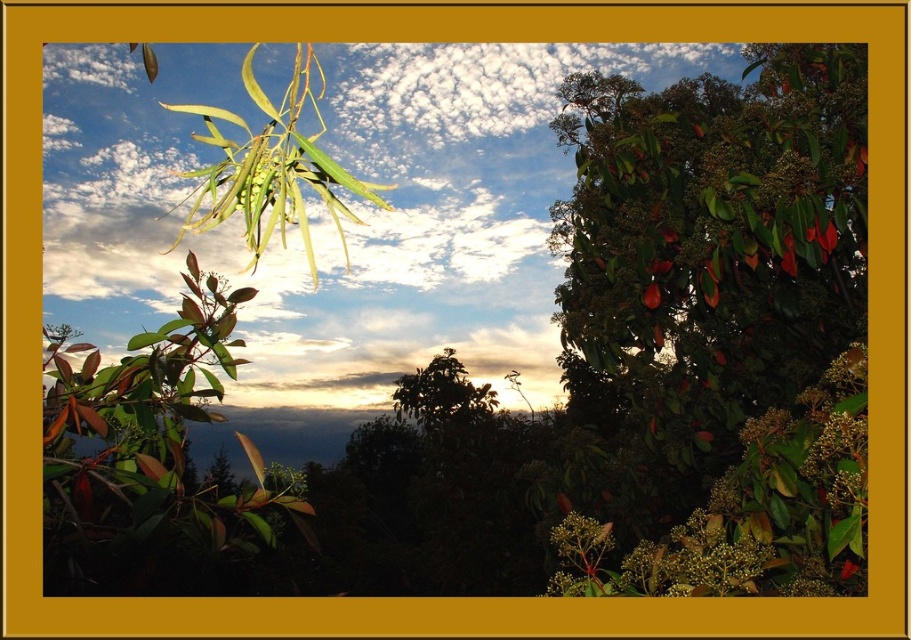
What do you see at coordinates (730, 292) in the screenshot? The height and width of the screenshot is (640, 911). I see `green glossy leaves at upper center` at bounding box center [730, 292].

I want to click on green glossy leaves at upper center, so click(730, 292).

Which is in front, point (118, 120) or point (206, 417)?

Point (206, 417) is in front.

Can you confirm if white fluffy cloud at upper center is positioned below shiny brown leaves at left?

No.

What do you see at coordinates (325, 212) in the screenshot? I see `white fluffy cloud at upper center` at bounding box center [325, 212].

Locate an element on the screen. The width and height of the screenshot is (911, 640). white fluffy cloud at upper center is located at coordinates (325, 212).

Can you confirm if white fluffy cloud at upper center is positioned above green glossy leaves at upper center?

Indeed, white fluffy cloud at upper center is positioned over green glossy leaves at upper center.

Who is higher up, white fluffy cloud at upper center or green glossy leaves at upper center?

white fluffy cloud at upper center

Locate an element on the screen. Image resolution: width=911 pixels, height=640 pixels. white fluffy cloud at upper center is located at coordinates (325, 212).